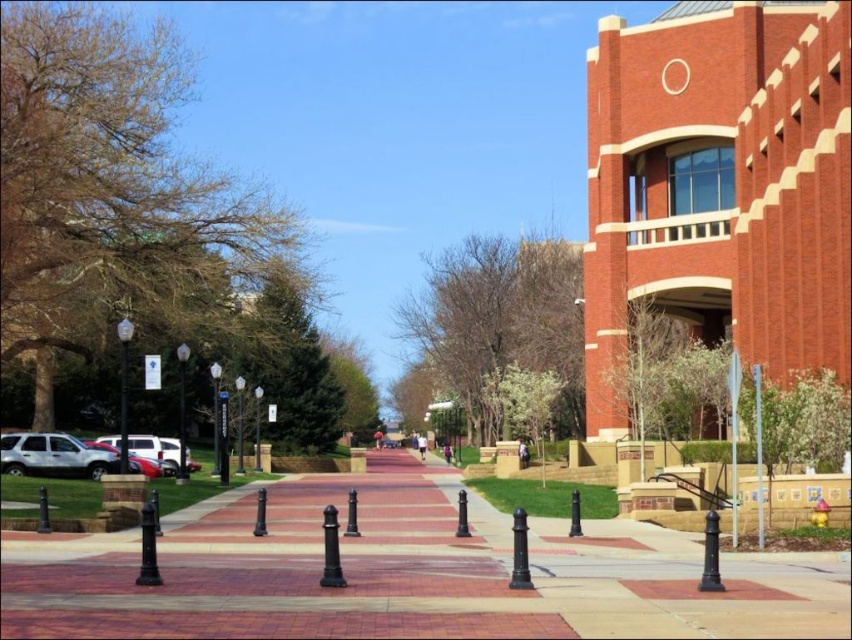
You are a delivery person with a cart that is 1.2 meters wide. You need to navigate through the brick pavement at center while avoiding the green leafy tree at center. Can your cart fit through the space between them?

The brick pavement at center might be wider than the green leafy tree at center, so there is a possibility that the cart can fit through the space. However, the exact width isn not specified, so it is recommended to check the actual space before proceeding.

You are a pedestrian walking along the red brick pathway bordered by black bollards. You notice a brown leafy tree at left and a metallic silver suv at left. Which object is bigger in size?

The brown leafy tree at left is larger in size compared to the metallic silver suv at left according to the description.